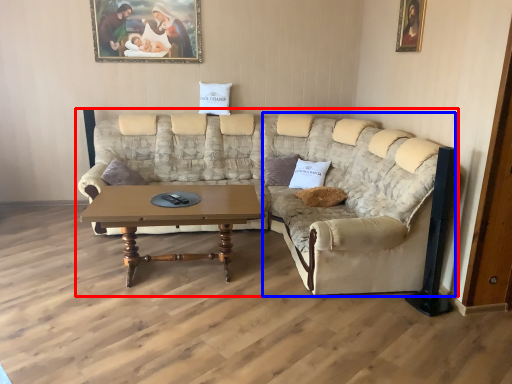
Question: Which object is closer to the camera taking this photo, studio couch (highlighted by a red box) or couch (highlighted by a blue box)?

Choices:
 (A) studio couch
 (B) couch

Answer: (A)